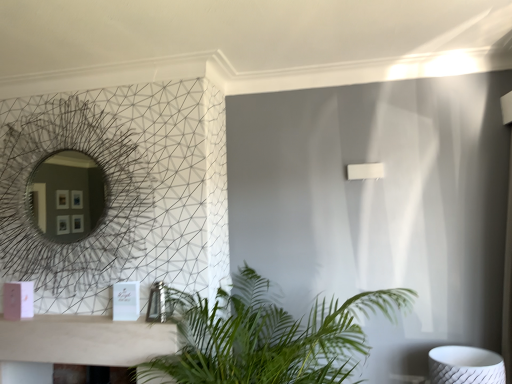
Locate an element on the screen. The width and height of the screenshot is (512, 384). metallic wire mesh mirror at upper left is located at coordinates (71, 197).

Describe the element at coordinates (71, 197) in the screenshot. I see `metallic wire mesh mirror at upper left` at that location.

The image size is (512, 384). Find the location of `green leafy plant at lower center`. green leafy plant at lower center is located at coordinates (266, 336).

What do you see at coordinates (266, 336) in the screenshot? I see `green leafy plant at lower center` at bounding box center [266, 336].

At what (x,y) coordinates should I click in order to perform the action: click on metallic wire mesh mirror at upper left. Please return your answer as a coordinate pair (x, y). Looking at the image, I should click on (71, 197).

Which is more to the left, green leafy plant at lower center or metallic wire mesh mirror at upper left?

metallic wire mesh mirror at upper left.

Who is more distant, green leafy plant at lower center or metallic wire mesh mirror at upper left?

Positioned behind is metallic wire mesh mirror at upper left.

Considering the positions of points (316, 375) and (70, 170), is point (316, 375) closer to camera compared to point (70, 170)?

Yes, point (316, 375) is closer to viewer.

From the image's perspective, is green leafy plant at lower center located above metallic wire mesh mirror at upper left?

No.

From a real-world perspective, is green leafy plant at lower center positioned under metallic wire mesh mirror at upper left based on gravity?

Correct, in the physical world, green leafy plant at lower center is lower than metallic wire mesh mirror at upper left.

Does green leafy plant at lower center have a lesser width compared to metallic wire mesh mirror at upper left?

No.

Who is taller, green leafy plant at lower center or metallic wire mesh mirror at upper left?

With more height is metallic wire mesh mirror at upper left.

Considering the sizes of objects green leafy plant at lower center and metallic wire mesh mirror at upper left in the image provided, who is smaller, green leafy plant at lower center or metallic wire mesh mirror at upper left?

metallic wire mesh mirror at upper left is smaller.

Is green leafy plant at lower center not inside metallic wire mesh mirror at upper left?

Yes.

Are green leafy plant at lower center and metallic wire mesh mirror at upper left far apart?

No.

Is green leafy plant at lower center looking in the opposite direction of metallic wire mesh mirror at upper left?

No, green leafy plant at lower center's orientation is not away from metallic wire mesh mirror at upper left.

Locate an element on the screen. mirror above the green leafy plant at lower center (from the image's perspective) is located at coordinates (71, 197).

Considering the relative positions of metallic wire mesh mirror at upper left and green leafy plant at lower center in the image provided, is metallic wire mesh mirror at upper left to the right of green leafy plant at lower center from the viewer's perspective?

No, metallic wire mesh mirror at upper left is not to the right of green leafy plant at lower center.

Is metallic wire mesh mirror at upper left closer to the viewer compared to green leafy plant at lower center?

No, metallic wire mesh mirror at upper left is further to the viewer.

Which is closer, (59, 223) or (233, 316)?

Point (59, 223).

From the image's perspective, between metallic wire mesh mirror at upper left and green leafy plant at lower center, who is located below?

green leafy plant at lower center is shown below in the image.

From a real-world perspective, is metallic wire mesh mirror at upper left positioned over green leafy plant at lower center based on gravity?

Yes, from a real-world perspective, metallic wire mesh mirror at upper left is over green leafy plant at lower center

Is metallic wire mesh mirror at upper left wider or thinner than green leafy plant at lower center?

metallic wire mesh mirror at upper left is thinner than green leafy plant at lower center.

Between metallic wire mesh mirror at upper left and green leafy plant at lower center, which one has more height?

With more height is metallic wire mesh mirror at upper left.

Which of these two, metallic wire mesh mirror at upper left or green leafy plant at lower center, is bigger?

green leafy plant at lower center is bigger.

Based on the photo, would you say metallic wire mesh mirror at upper left contains green leafy plant at lower center?

No, green leafy plant at lower center is located outside of metallic wire mesh mirror at upper left.

Is metallic wire mesh mirror at upper left next to green leafy plant at lower center?

There is a gap between metallic wire mesh mirror at upper left and green leafy plant at lower center.

Is metallic wire mesh mirror at upper left facing away from green leafy plant at lower center?

No, green leafy plant at lower center is not at the back of metallic wire mesh mirror at upper left.

You are a GUI agent. You are given a task and a screenshot of the screen. Output one action in this format:
    pyautogui.click(x=<x>, y=<y>)
    Task: Click on the mirror that appears above the green leafy plant at lower center (from a real-world perspective)
    The image size is (512, 384).
    Given the screenshot: What is the action you would take?
    pyautogui.click(x=71, y=197)

In order to click on houseplant located on the right of metallic wire mesh mirror at upper left in this screenshot , I will do `click(266, 336)`.

Identify the location of mirror lying behind the green leafy plant at lower center. Image resolution: width=512 pixels, height=384 pixels. (71, 197).